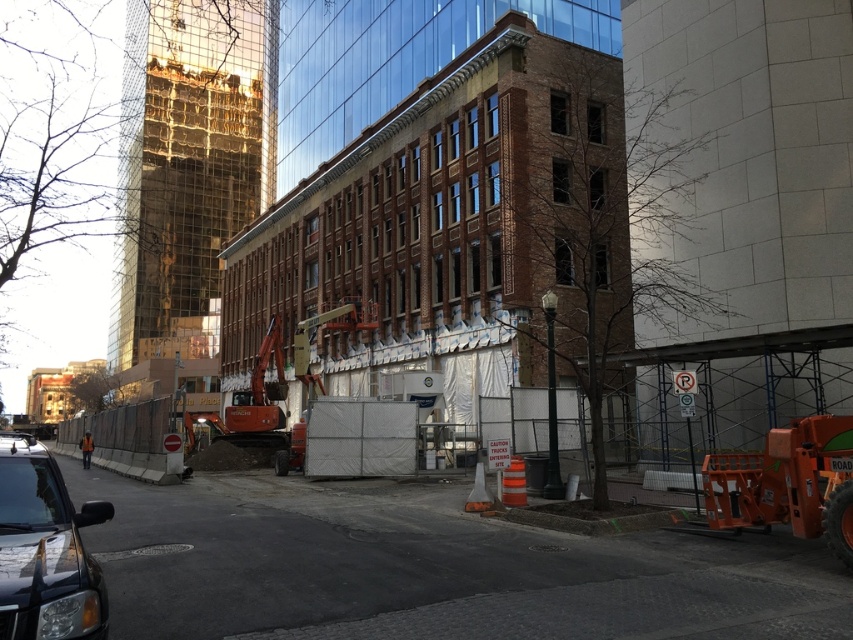
Which is in front, point (39, 483) or point (91, 440)?

Point (39, 483)

Where is `shiny black suv at lower left`? shiny black suv at lower left is located at coordinates (45, 550).